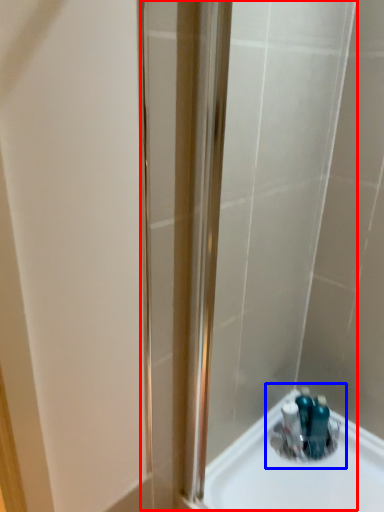
Question: Which point is further to the camera, shower door (highlighted by a red box) or sink (highlighted by a blue box)?

Choices:
 (A) shower door
 (B) sink

Answer: (B)